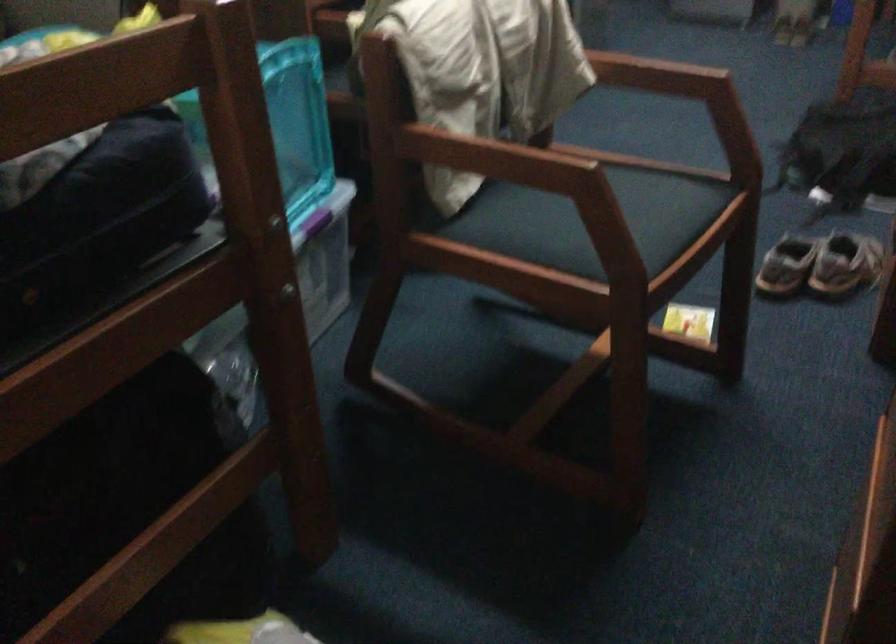
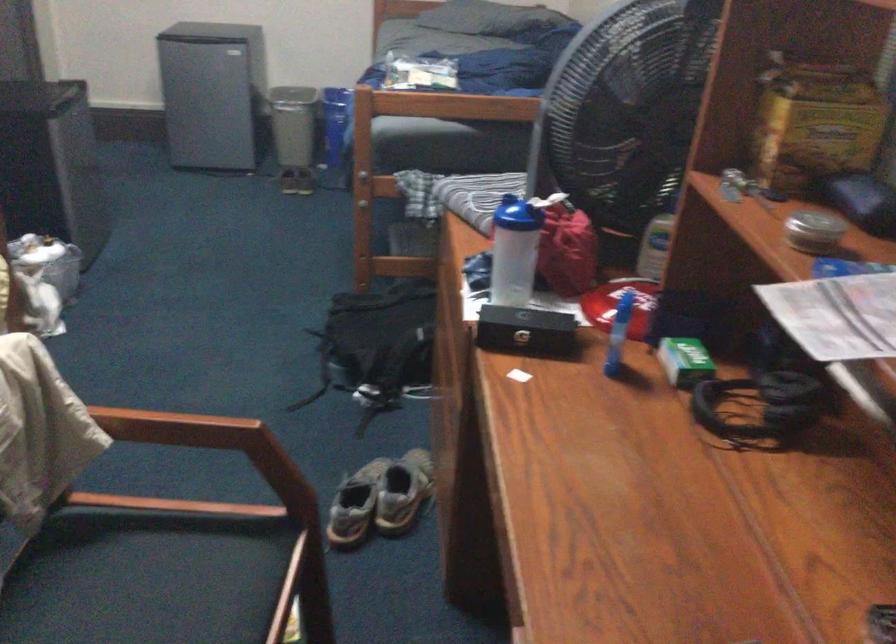
The point at [648,76] is marked in the first image. Where is the corresponding point in the second image?

(176, 428)